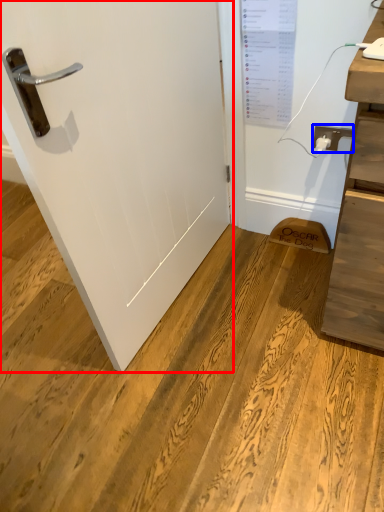
Question: Which point is closer to the camera, door (highlighted by a red box) or electric outlet (highlighted by a blue box)?

Choices:
 (A) door
 (B) electric outlet

Answer: (A)